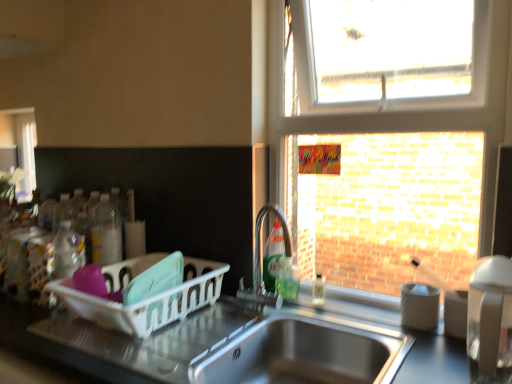
Question: Does stainless steel sink at lower center have a greater width compared to green translucent soap dispenser at sink, positioned as the 2th bottle in right-to-left order?

Choices:
 (A) no
 (B) yes

Answer: (B)

Question: Is stainless steel sink at lower center oriented towards green translucent soap dispenser at sink, positioned as the 2th bottle in right-to-left order?

Choices:
 (A) yes
 (B) no

Answer: (B)

Question: From a real-world perspective, is stainless steel sink at lower center physically above green translucent soap dispenser at sink, acting as the third bottle starting from the left?

Choices:
 (A) no
 (B) yes

Answer: (A)

Question: Could green translucent soap dispenser at sink, acting as the third bottle starting from the left, be considered to be inside stainless steel sink at lower center?

Choices:
 (A) yes
 (B) no

Answer: (B)

Question: Does stainless steel sink at lower center have a larger size compared to green translucent soap dispenser at sink, acting as the third bottle starting from the left?

Choices:
 (A) yes
 (B) no

Answer: (A)

Question: From the image's perspective, is clear glass window at upper right located above or below green translucent soap dispenser at sink, acting as the third bottle starting from the left?

Choices:
 (A) below
 (B) above

Answer: (B)

Question: In terms of width, does clear glass window at upper right look wider or thinner when compared to green translucent soap dispenser at sink, acting as the third bottle starting from the left?

Choices:
 (A) thin
 (B) wide

Answer: (B)

Question: Relative to green translucent soap dispenser at sink, positioned as the 2th bottle in right-to-left order, is clear glass window at upper right in front or behind?

Choices:
 (A) behind
 (B) front

Answer: (B)

Question: Is point (350, 150) positioned closer to the camera than point (293, 264)?

Choices:
 (A) farther
 (B) closer

Answer: (B)

Question: Would you say white plastic dish rack at left, the first appliance viewed from the left, is inside or outside green translucent soap dispenser at sink, positioned as the 2th bottle in right-to-left order?

Choices:
 (A) outside
 (B) inside

Answer: (A)

Question: From a real-world perspective, is white plastic dish rack at left, the first appliance viewed from the left, physically located above or below green translucent soap dispenser at sink, acting as the third bottle starting from the left?

Choices:
 (A) above
 (B) below

Answer: (A)

Question: Is white plastic dish rack at left, the first appliance viewed from the left, in front of or behind green translucent soap dispenser at sink, acting as the third bottle starting from the left, in the image?

Choices:
 (A) behind
 (B) front

Answer: (B)

Question: Based on their positions, is white plastic dish rack at left, acting as the 1th appliance starting from the back, located to the left or right of green translucent soap dispenser at sink, acting as the third bottle starting from the left?

Choices:
 (A) left
 (B) right

Answer: (A)

Question: Considering the positions of green translucent soap dispenser at sink, acting as the third bottle starting from the left, and stainless steel sink at lower center in the image, is green translucent soap dispenser at sink, acting as the third bottle starting from the left, wider or thinner than stainless steel sink at lower center?

Choices:
 (A) thin
 (B) wide

Answer: (A)

Question: From their relative heights in the image, would you say green translucent soap dispenser at sink, acting as the third bottle starting from the left, is taller or shorter than stainless steel sink at lower center?

Choices:
 (A) short
 (B) tall

Answer: (A)